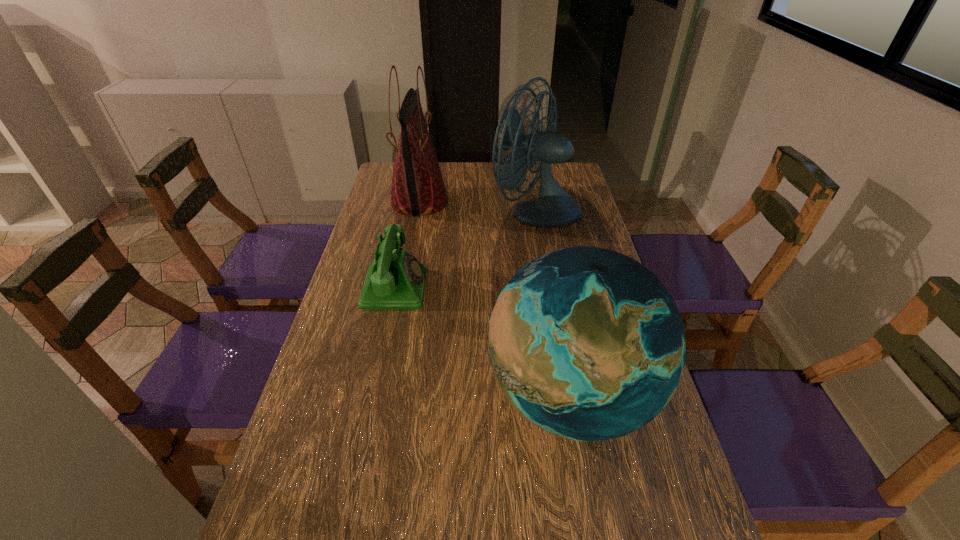
What are the coordinates of `vacant space located 0.190m on the back of the globe` in the screenshot? It's located at (550, 285).

You are a GUI agent. You are given a task and a screenshot of the screen. Output one action in this format:
    pyautogui.click(x=<x>, y=<y>)
    Task: Click on the vacant space situated 0.400m on the dial of the shortest object
    
    Given the screenshot: What is the action you would take?
    pyautogui.click(x=563, y=288)

The image size is (960, 540). Identify the location of handbag positioned at the far edge. (418, 188).

Where is `fan present at the far edge`? The height and width of the screenshot is (540, 960). fan present at the far edge is located at coordinates (554, 207).

Image resolution: width=960 pixels, height=540 pixels. Identify the location of handbag that is at the left edge. (418, 188).

The width and height of the screenshot is (960, 540). I want to click on telephone located in the left edge section of the desktop, so point(395,280).

Find the location of a particular element. fan at the right edge is located at coordinates (554, 207).

Locate an element on the screen. This screenshot has width=960, height=540. globe at the right edge is located at coordinates (586, 343).

You are a GUI agent. You are given a task and a screenshot of the screen. Output one action in this format:
    pyautogui.click(x=<x>, y=<y>)
    Task: Click on the object at the far left corner
    Image resolution: width=960 pixels, height=540 pixels.
    Given the screenshot: What is the action you would take?
    pyautogui.click(x=418, y=188)

Find the location of a particular element. object that is at the far right corner is located at coordinates (554, 207).